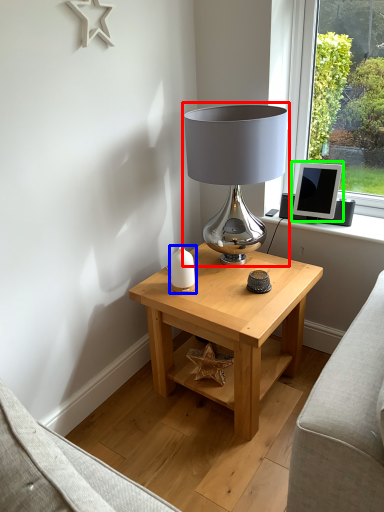
Question: Based on their relative distances, which object is farther from lamp (highlighted by a red box)? Choose from candle holder (highlighted by a blue box) and computer monitor (highlighted by a green box).

Choices:
 (A) candle holder
 (B) computer monitor

Answer: (B)